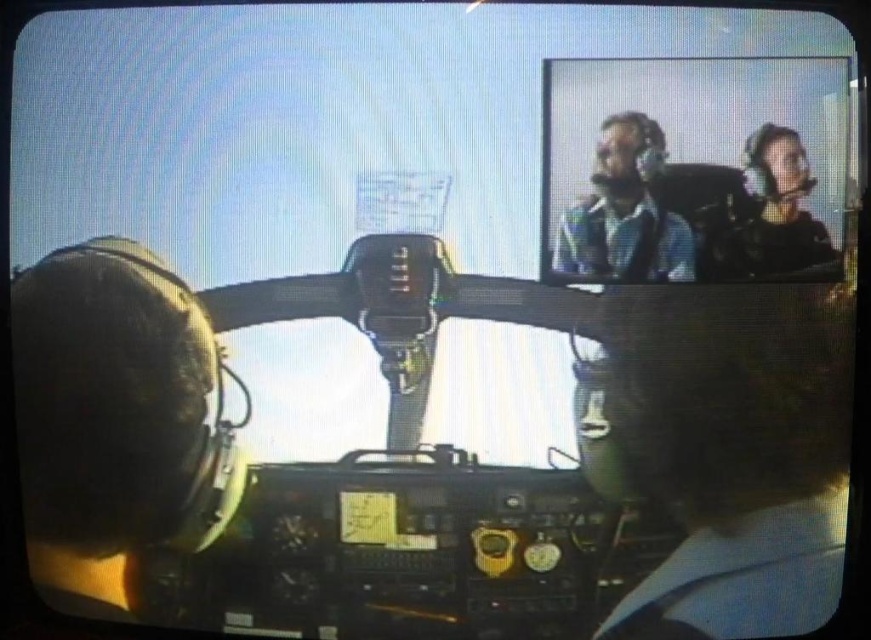
Question: Which object appears farthest from the camera in this image?

Choices:
 (A) matte blue shirt at upper right
 (B) dark brown hair at center
 (C) matte black helmet at left

Answer: (C)

Question: Does matte blue shirt at upper right appear over matte black helmet at upper right?

Choices:
 (A) yes
 (B) no

Answer: (A)

Question: Estimate the real-world distances between objects in this image. Which object is farther from the matte blue shirt at upper right?

Choices:
 (A) matte black helmet at left
 (B) dark brown hair at center

Answer: (A)

Question: Does matte black helmet at left have a greater width compared to matte blue shirt at upper right?

Choices:
 (A) no
 (B) yes

Answer: (B)

Question: Can you confirm if dark brown hair at center is positioned above matte blue shirt at upper right?

Choices:
 (A) yes
 (B) no

Answer: (B)

Question: Which object is the farthest from the dark brown hair at center?

Choices:
 (A) matte black helmet at upper right
 (B) matte blue shirt at upper right
 (C) matte black helmet at left

Answer: (C)